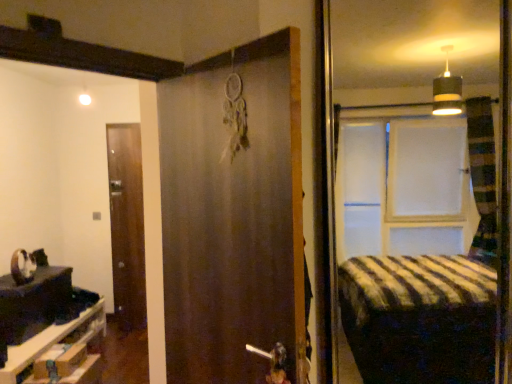
Question: Does wooden drawer at lower left have a larger size compared to brown matte door at center, positioned as the 2th door in back-to-front order?

Choices:
 (A) yes
 (B) no

Answer: (A)

Question: Can you confirm if wooden drawer at lower left is taller than brown matte door at center, positioned as the 2th door in back-to-front order?

Choices:
 (A) no
 (B) yes

Answer: (A)

Question: From the image's perspective, would you say wooden drawer at lower left is shown under brown matte door at center, the 1th door in the right-to-left sequence?

Choices:
 (A) yes
 (B) no

Answer: (A)

Question: From the image's perspective, would you say wooden drawer at lower left is positioned over brown matte door at center, marked as the second door in a left-to-right arrangement?

Choices:
 (A) no
 (B) yes

Answer: (A)

Question: From a real-world perspective, is wooden drawer at lower left below brown matte door at center, the 1th door in the front-to-back sequence?

Choices:
 (A) yes
 (B) no

Answer: (A)

Question: Is wooden drawer at lower left placed right next to brown matte door at center, the 1th door in the right-to-left sequence?

Choices:
 (A) yes
 (B) no

Answer: (B)

Question: Considering the relative sizes of black glossy table at lower left and brown wooden door at left, positioned as the 1th door in back-to-front order, in the image provided, is black glossy table at lower left bigger than brown wooden door at left, positioned as the 1th door in back-to-front order,?

Choices:
 (A) yes
 (B) no

Answer: (A)

Question: From the image's perspective, is black glossy table at lower left on brown wooden door at left, positioned as the 1th door in back-to-front order?

Choices:
 (A) no
 (B) yes

Answer: (A)

Question: Does black glossy table at lower left have a greater height compared to brown wooden door at left, marked as the second door in a front-to-back arrangement?

Choices:
 (A) no
 (B) yes

Answer: (A)

Question: Can you confirm if black glossy table at lower left is smaller than brown wooden door at left, which is counted as the first door, starting from the left?

Choices:
 (A) no
 (B) yes

Answer: (A)

Question: Considering the relative sizes of black glossy table at lower left and brown wooden door at left, marked as the second door in a front-to-back arrangement, in the image provided, is black glossy table at lower left shorter than brown wooden door at left, marked as the second door in a front-to-back arrangement,?

Choices:
 (A) yes
 (B) no

Answer: (A)

Question: From a real-world perspective, does black glossy table at lower left stand above brown wooden door at left, positioned as the 1th door in back-to-front order?

Choices:
 (A) yes
 (B) no

Answer: (B)

Question: Is wooden drawer at lower left positioned before brown wooden door at left, which is counted as the 2th door, starting from the right?

Choices:
 (A) yes
 (B) no

Answer: (A)